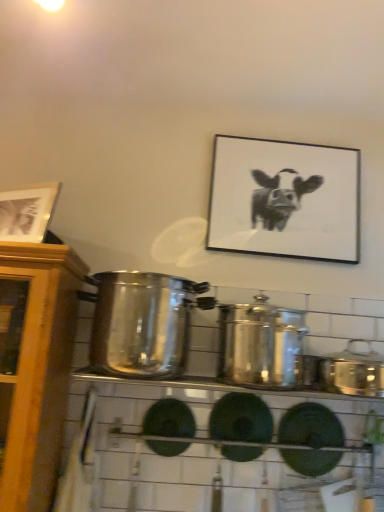
Question: Which direction should I rotate to face black matte picture frame at upper center, positioned as the 1th picture frame in right-to-left order, — up or down?

Choices:
 (A) down
 (B) up

Answer: (B)

Question: From the image's perspective, is wooden picture frame at upper left, which is the 1th picture frame in front-to-back order, on satin silver pot at center, which is the third crock pot from right to left?

Choices:
 (A) yes
 (B) no

Answer: (A)

Question: Is satin silver pot at center, which is the third crock pot from right to left, a part of wooden picture frame at upper left, which is counted as the second picture frame, starting from the back?

Choices:
 (A) yes
 (B) no

Answer: (B)

Question: Is wooden picture frame at upper left, which is the 1th picture frame in front-to-back order, positioned in front of satin silver pot at center, placed as the first crock pot when sorted from left to right?

Choices:
 (A) no
 (B) yes

Answer: (A)

Question: Is wooden picture frame at upper left, the 1th picture frame from the left, to the left of satin silver pot at center, which is the third crock pot from right to left, from the viewer's perspective?

Choices:
 (A) yes
 (B) no

Answer: (A)

Question: Is wooden picture frame at upper left, which is the 1th picture frame in front-to-back order, not near satin silver pot at center, placed as the first crock pot when sorted from left to right?

Choices:
 (A) no
 (B) yes

Answer: (A)

Question: Considering the relative sizes of wooden picture frame at upper left, which is the 1th picture frame in front-to-back order, and satin silver pot at center, placed as the first crock pot when sorted from left to right, in the image provided, is wooden picture frame at upper left, which is the 1th picture frame in front-to-back order, taller than satin silver pot at center, placed as the first crock pot when sorted from left to right,?

Choices:
 (A) no
 (B) yes

Answer: (A)

Question: From a real-world perspective, is wooden picture frame at upper left, the second picture frame when ordered from right to left, positioned under shiny metallic crock pot at center, the second crock pot when ordered from right to left, based on gravity?

Choices:
 (A) yes
 (B) no

Answer: (B)

Question: Considering the relative sizes of wooden picture frame at upper left, the 1th picture frame from the left, and shiny metallic crock pot at center, the second crock pot when ordered from right to left, in the image provided, is wooden picture frame at upper left, the 1th picture frame from the left, bigger than shiny metallic crock pot at center, the second crock pot when ordered from right to left,?

Choices:
 (A) yes
 (B) no

Answer: (B)

Question: Considering the relative sizes of wooden picture frame at upper left, the second picture frame when ordered from right to left, and shiny metallic crock pot at center, acting as the 2th crock pot starting from the left, in the image provided, is wooden picture frame at upper left, the second picture frame when ordered from right to left, taller than shiny metallic crock pot at center, acting as the 2th crock pot starting from the left,?

Choices:
 (A) no
 (B) yes

Answer: (A)

Question: Can we say wooden picture frame at upper left, which is counted as the second picture frame, starting from the back, lies outside shiny metallic crock pot at center, the second crock pot when ordered from right to left?

Choices:
 (A) no
 (B) yes

Answer: (B)

Question: Can you confirm if wooden picture frame at upper left, the 1th picture frame from the left, is smaller than shiny metallic crock pot at center, acting as the 2th crock pot starting from the left?

Choices:
 (A) yes
 (B) no

Answer: (A)

Question: From a real-world perspective, is wooden picture frame at upper left, which is counted as the second picture frame, starting from the back, on top of shiny metallic crock pot at center, acting as the 2th crock pot starting from the left?

Choices:
 (A) no
 (B) yes

Answer: (B)

Question: Considering the relative sizes of black matte picture frame at upper center, the second picture frame when ordered from left to right, and satin silver pot at center, placed as the first crock pot when sorted from left to right, in the image provided, is black matte picture frame at upper center, the second picture frame when ordered from left to right, thinner than satin silver pot at center, placed as the first crock pot when sorted from left to right,?

Choices:
 (A) no
 (B) yes

Answer: (B)